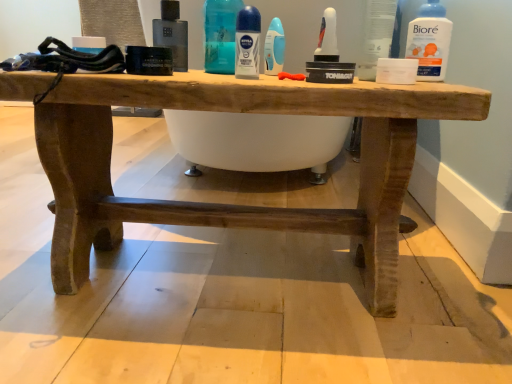
Identify the location of vacant area that lies in front of blue plastic deodorant at center, placed as the 2th cleaning product when sorted from right to left. The width and height of the screenshot is (512, 384). (208, 72).